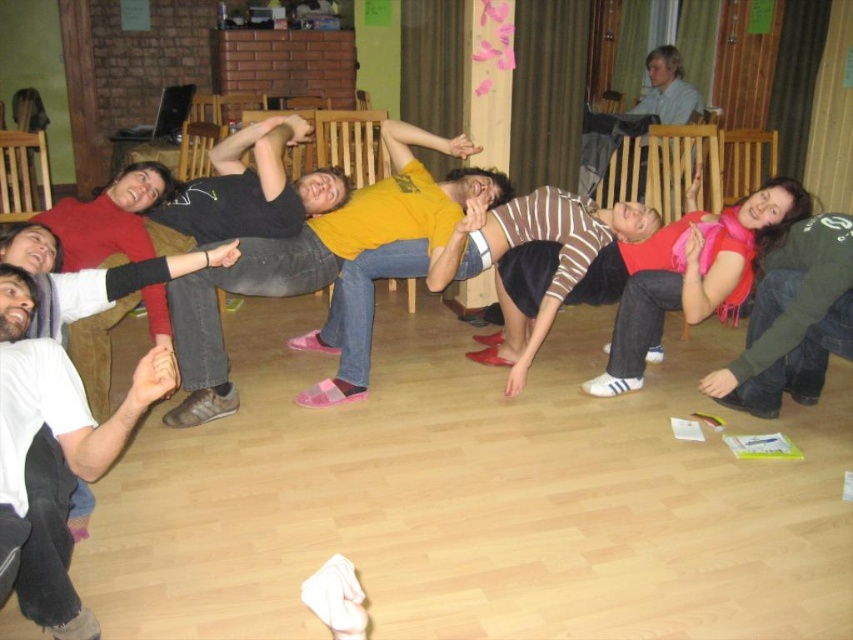
Question: Among these objects, which one is nearest to the camera?

Choices:
 (A) white cotton shirt at lower left
 (B) green fuzzy sweater at right

Answer: (A)

Question: Among these points, which one is nearest to the camera?

Choices:
 (A) (651, 316)
 (B) (706, 392)

Answer: (B)

Question: Which object is farther from the camera taking this photo?

Choices:
 (A) white cotton shirt at lower left
 (B) pink scarf at center
 (C) green fuzzy sweater at right

Answer: (B)

Question: Is white cotton shirt at lower left bigger than green fuzzy sweater at right?

Choices:
 (A) no
 (B) yes

Answer: (A)

Question: Is white cotton shirt at lower left behind pink scarf at center?

Choices:
 (A) no
 (B) yes

Answer: (A)

Question: Does pink scarf at center appear over green fuzzy sweater at right?

Choices:
 (A) no
 (B) yes

Answer: (B)